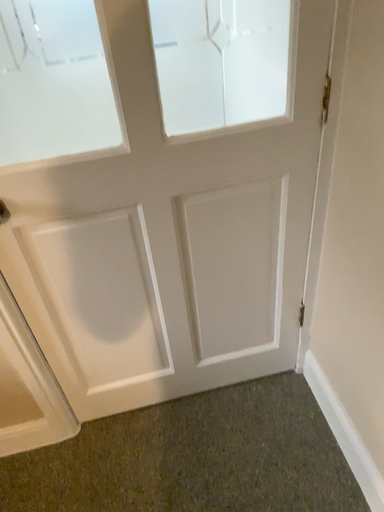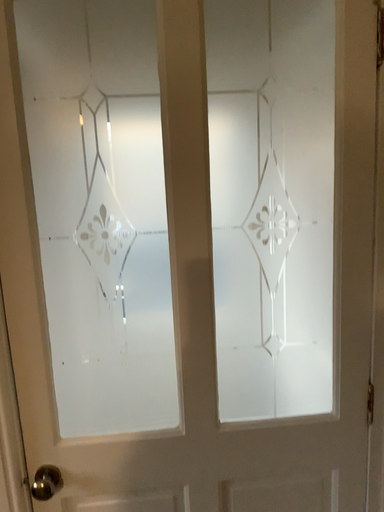
Question: How did the camera likely rotate when shooting the video?

Choices:
 (A) rotated upward
 (B) rotated downward

Answer: (A)